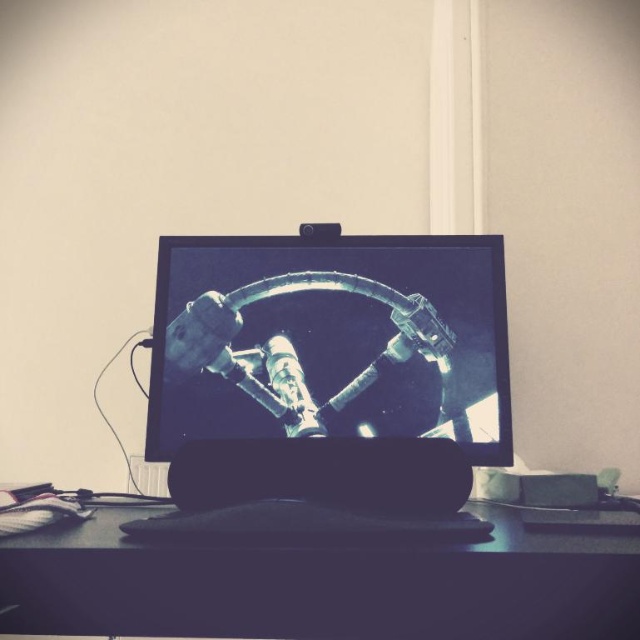
Question: Among these objects, which one is nearest to the camera?

Choices:
 (A) black matte computer desk at center
 (B) matte black monitor at center

Answer: (A)

Question: Does matte black monitor at center appear on the right side of black matte computer desk at center?

Choices:
 (A) no
 (B) yes

Answer: (A)

Question: Which point is closer to the camera taking this photo?

Choices:
 (A) (417, 433)
 (B) (381, 637)

Answer: (B)

Question: Does matte black monitor at center have a larger size compared to black matte computer desk at center?

Choices:
 (A) no
 (B) yes

Answer: (A)

Question: Is matte black monitor at center wider than black matte computer desk at center?

Choices:
 (A) yes
 (B) no

Answer: (B)